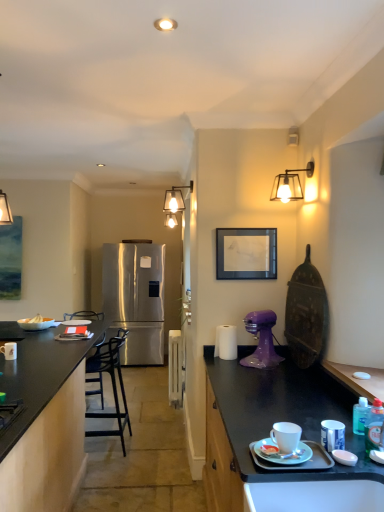
Where is `free space above porcelain saucer at lower right (from a real-world perspective)`? The width and height of the screenshot is (384, 512). free space above porcelain saucer at lower right (from a real-world perspective) is located at coordinates (274, 450).